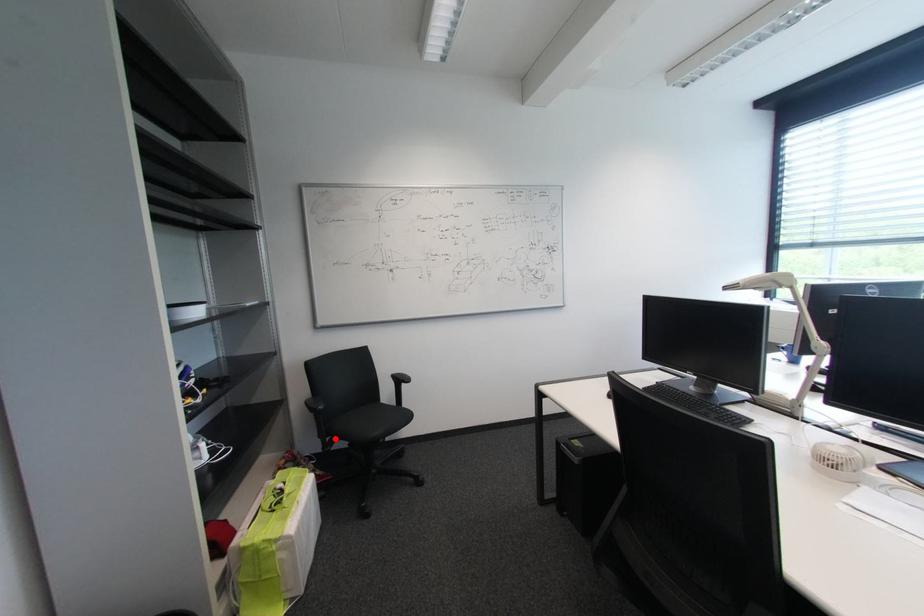
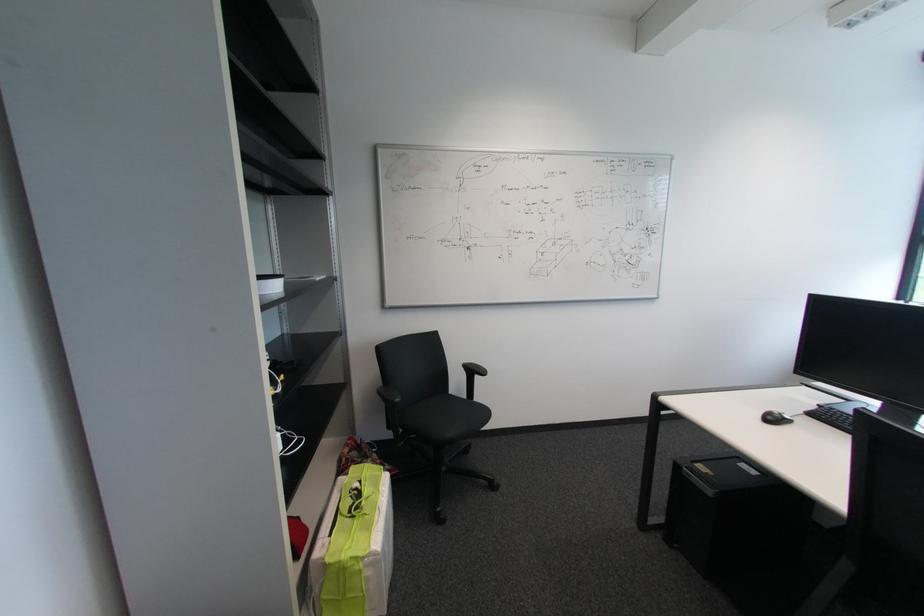
Where in the second image is the point corresponding to the highlighted location from the first image?

(407, 432)